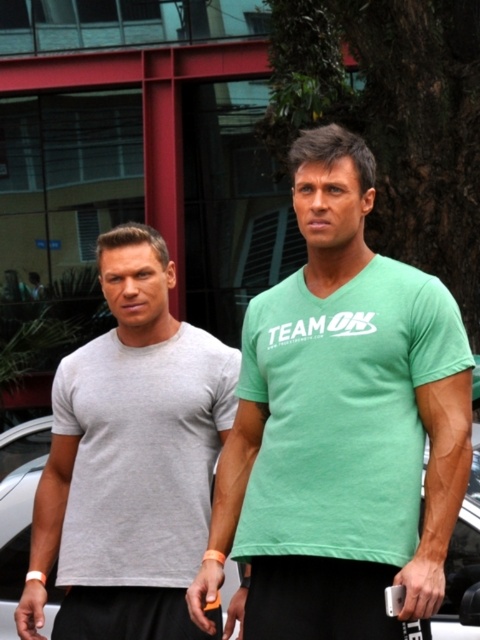
Question: Among these points, which one is nearest to the camera?

Choices:
 (A) (466, 573)
 (B) (397, 454)
 (C) (135, 394)

Answer: (B)

Question: Is matte gray t-shirt at left closer to camera compared to white matte car at center?

Choices:
 (A) yes
 (B) no

Answer: (A)

Question: Can you confirm if green matte t-shirt at center is positioned below white matte car at center?

Choices:
 (A) yes
 (B) no

Answer: (B)

Question: Which point is closer to the camera?

Choices:
 (A) white matte car at center
 (B) green matte t-shirt at center
 (C) matte gray t-shirt at left

Answer: (B)

Question: Which point appears farthest from the camera in this image?

Choices:
 (A) (454, 396)
 (B) (192, 550)
 (C) (479, 492)

Answer: (C)

Question: Can you confirm if matte gray t-shirt at left is positioned above white matte car at center?

Choices:
 (A) no
 (B) yes

Answer: (B)